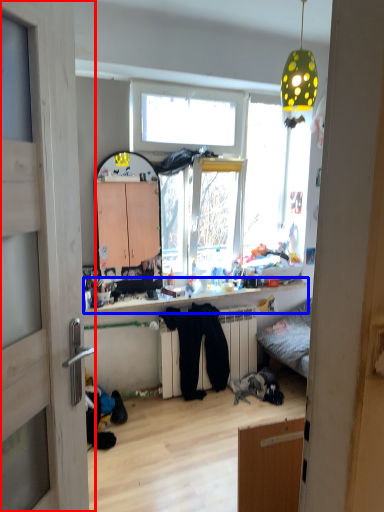
Question: Among these objects, which one is farthest to the camera, door (highlighted by a red box) or counter top (highlighted by a blue box)?

Choices:
 (A) door
 (B) counter top

Answer: (B)